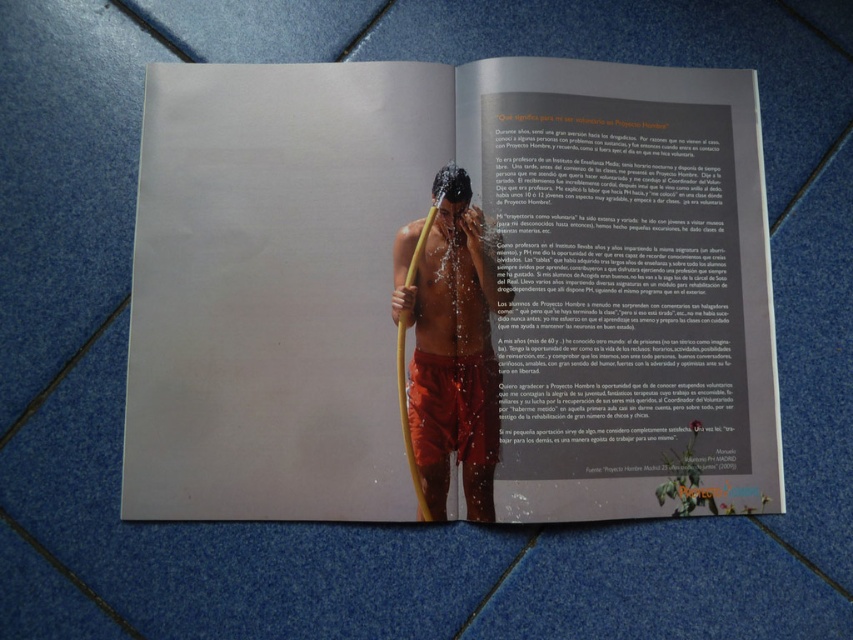
Question: Is matte yellow hose at center positioned at the back of shiny orange shorts at center?

Choices:
 (A) yes
 (B) no

Answer: (B)

Question: Does matte yellow hose at center lie in front of shiny orange shorts at center?

Choices:
 (A) no
 (B) yes

Answer: (B)

Question: Is matte yellow hose at center bigger than shiny orange shorts at center?

Choices:
 (A) yes
 (B) no

Answer: (A)